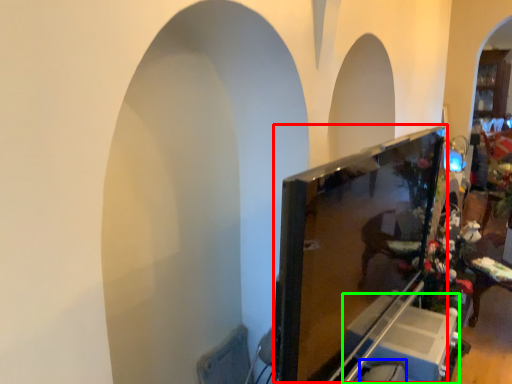
Question: Which is nearer to the computer monitor (highlighted by a red box)? swivel chair (highlighted by a blue box) or furniture (highlighted by a green box).

Choices:
 (A) swivel chair
 (B) furniture

Answer: (B)